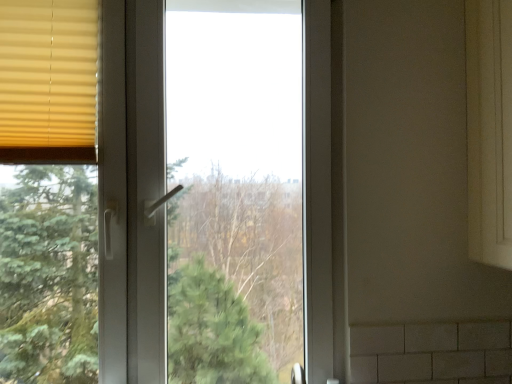
Image resolution: width=512 pixels, height=384 pixels. What do you see at coordinates (48, 81) in the screenshot?
I see `matte yellow blinds at left` at bounding box center [48, 81].

Where is `matte yellow blinds at left`? matte yellow blinds at left is located at coordinates (48, 81).

Find the location of a particular element. Image resolution: width=512 pixels, height=384 pixels. white plastic window at center is located at coordinates (132, 191).

Describe the element at coordinates (132, 191) in the screenshot. I see `white plastic window at center` at that location.

I want to click on matte yellow blinds at left, so click(48, 81).

Which object is positioned more to the left, white plastic window at center or matte yellow blinds at left?

From the viewer's perspective, matte yellow blinds at left appears more on the left side.

Who is more distant, white plastic window at center or matte yellow blinds at left?

matte yellow blinds at left is behind.

Which point is more distant from viewer, (318, 0) or (67, 10)?

The point (318, 0) is farther from the camera.

From the image's perspective, between white plastic window at center and matte yellow blinds at left, who is located below?

white plastic window at center is shown below in the image.

From a real-world perspective, is white plastic window at center below matte yellow blinds at left?

Yes, from a real-world perspective, white plastic window at center is beneath matte yellow blinds at left.

Which object is thinner, white plastic window at center or matte yellow blinds at left?

matte yellow blinds at left.

Does white plastic window at center have a lesser height compared to matte yellow blinds at left?

No, white plastic window at center is not shorter than matte yellow blinds at left.

Who is smaller, white plastic window at center or matte yellow blinds at left?

matte yellow blinds at left.

Is white plastic window at center spatially inside matte yellow blinds at left, or outside of it?

white plastic window at center is not enclosed by matte yellow blinds at left.

Would you say white plastic window at center is a long distance from matte yellow blinds at left?

white plastic window at center is near matte yellow blinds at left, not far away.

Is matte yellow blinds at left at the back of white plastic window at center?

Yes, white plastic window at center's orientation is away from matte yellow blinds at left.

This screenshot has width=512, height=384. Identify the location of window blind above the white plastic window at center (from a real-world perspective). (48, 81).

Is matte yellow blinds at left to the right of white plastic window at center from the viewer's perspective?

In fact, matte yellow blinds at left is to the left of white plastic window at center.

Considering the relative positions of matte yellow blinds at left and white plastic window at center in the image provided, is matte yellow blinds at left behind white plastic window at center?

Yes, it is.

Is point (74, 160) positioned in front of point (137, 319)?

Yes, it is in front of point (137, 319).

From the image's perspective, which object appears higher, matte yellow blinds at left or white plastic window at center?

matte yellow blinds at left appears higher in the image.

From a real-world perspective, is matte yellow blinds at left below white plastic window at center?

Actually, matte yellow blinds at left is physically above white plastic window at center in the real world.

Between matte yellow blinds at left and white plastic window at center, which one has larger width?

white plastic window at center.

Between matte yellow blinds at left and white plastic window at center, which one has more height?

With more height is white plastic window at center.

In the scene shown: Considering the sizes of objects matte yellow blinds at left and white plastic window at center in the image provided, who is smaller, matte yellow blinds at left or white plastic window at center?

Smaller between the two is matte yellow blinds at left.

Do you think matte yellow blinds at left is within white plastic window at center, or outside of it?

matte yellow blinds at left is enclosed within white plastic window at center.

Are matte yellow blinds at left and white plastic window at center beside each other?

matte yellow blinds at left and white plastic window at center are clearly separated.

Based on the photo, is white plastic window at center at the back of matte yellow blinds at left?

Correct, matte yellow blinds at left is looking away from white plastic window at center.

How many degrees apart are the facing directions of matte yellow blinds at left and white plastic window at center?

0.00192 degrees separate the facing orientations of matte yellow blinds at left and white plastic window at center.

This screenshot has height=384, width=512. I want to click on window blind located on the left of white plastic window at center, so click(x=48, y=81).

You are a GUI agent. You are given a task and a screenshot of the screen. Output one action in this format:
    pyautogui.click(x=<x>, y=<y>)
    Task: Click on the window beneath the matte yellow blinds at left (from a real-world perspective)
    
    Given the screenshot: What is the action you would take?
    pyautogui.click(x=132, y=191)

Find the location of a particular element. This screenshot has width=512, height=384. window below the matte yellow blinds at left (from the image's perspective) is located at coordinates (132, 191).